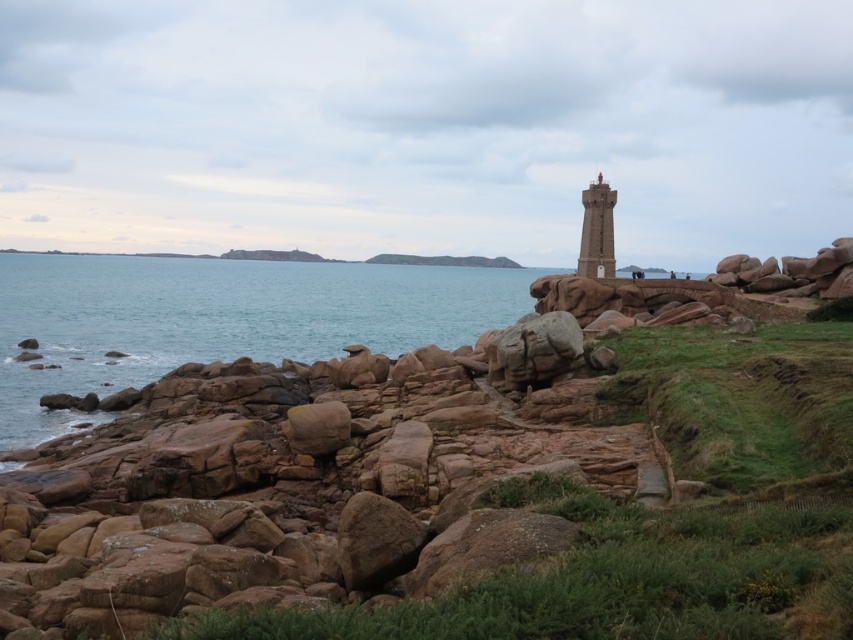
Is blue water at lower left bigger than smooth stone lighthouse at center?

Correct, blue water at lower left is larger in size than smooth stone lighthouse at center.

Is blue water at lower left to the left of smooth stone lighthouse at center from the viewer's perspective?

Yes, blue water at lower left is to the left of smooth stone lighthouse at center.

Find the location of a particular element. The image size is (853, 640). blue water at lower left is located at coordinates (219, 320).

At what (x,y) coordinates should I click in order to perform the action: click on blue water at lower left. Please return your answer as a coordinate pair (x, y). The image size is (853, 640). Looking at the image, I should click on (219, 320).